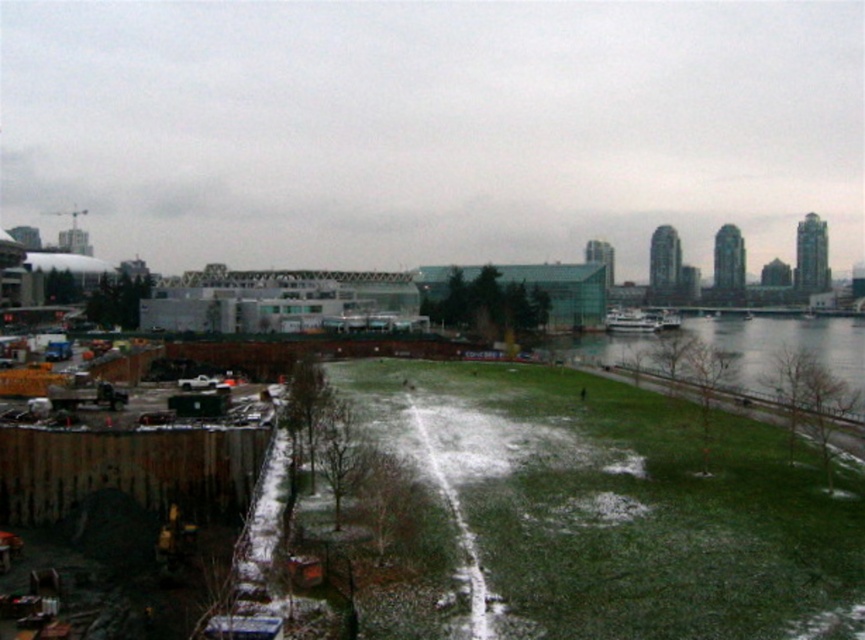
Does point (840, 468) come closer to viewer compared to point (716, 323)?

Yes, point (840, 468) is closer to viewer.

Which of these two, green grass at lower center or green grass at lower right, stands shorter?

With less height is green grass at lower center.

Where is `green grass at lower center`? green grass at lower center is located at coordinates (609, 512).